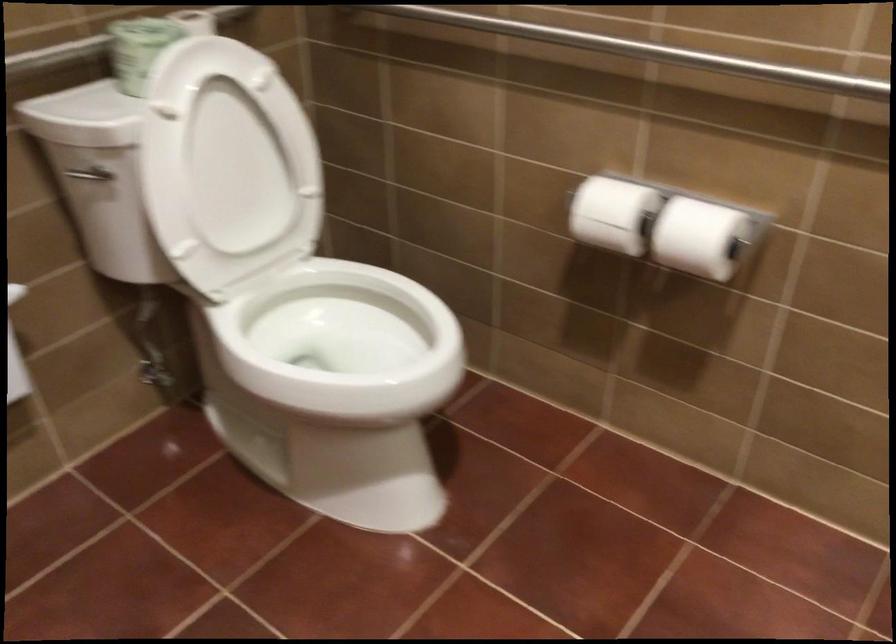
The images are taken continuously from a first-person perspective. In which direction is your viewpoint rotating?

The camera's rotation is toward right-down.